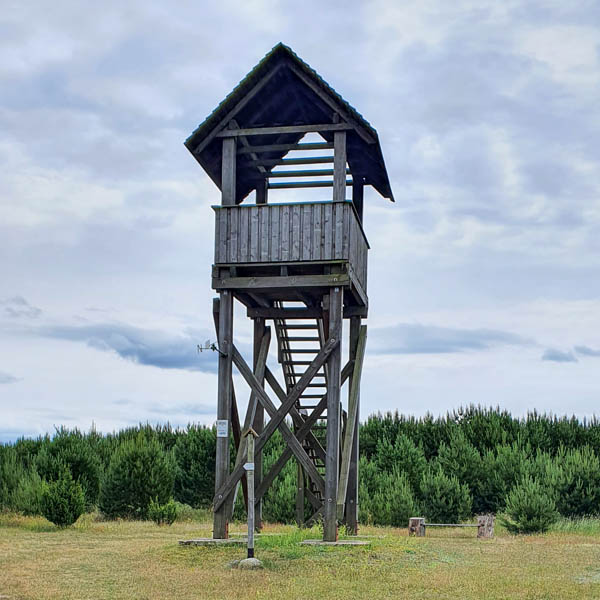
This screenshot has width=600, height=600. I want to click on wood post, so click(x=250, y=502).